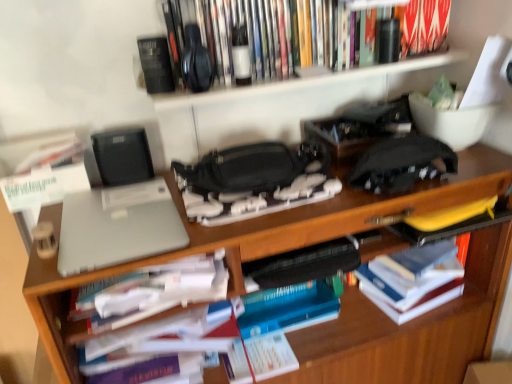
Question: Is sleek silver laptop at left located within wooden desk at center?

Choices:
 (A) yes
 (B) no

Answer: (A)

Question: Does wooden desk at center appear on the right side of sleek silver laptop at left?

Choices:
 (A) yes
 (B) no

Answer: (A)

Question: Is the depth of wooden desk at center greater than that of sleek silver laptop at left?

Choices:
 (A) no
 (B) yes

Answer: (A)

Question: Is wooden desk at center far away from sleek silver laptop at left?

Choices:
 (A) no
 (B) yes

Answer: (A)

Question: From the image's perspective, is wooden desk at center above sleek silver laptop at left?

Choices:
 (A) yes
 (B) no

Answer: (B)

Question: Considering the relative sizes of wooden desk at center and sleek silver laptop at left in the image provided, is wooden desk at center shorter than sleek silver laptop at left?

Choices:
 (A) yes
 (B) no

Answer: (B)

Question: Is hardcover book at right, the third book when ordered from top to bottom, placed right next to white paper at center?

Choices:
 (A) no
 (B) yes

Answer: (A)

Question: Can you confirm if hardcover book at right, the 1th book ordered from the bottom, is bigger than white paper at center?

Choices:
 (A) no
 (B) yes

Answer: (A)

Question: From the image's perspective, is hardcover book at right, the third book when ordered from top to bottom, located above white paper at center?

Choices:
 (A) no
 (B) yes

Answer: (B)

Question: Could you tell me if hardcover book at right, the 1th book ordered from the bottom, is turned towards white paper at center?

Choices:
 (A) yes
 (B) no

Answer: (B)

Question: Can you confirm if hardcover book at right, the 1th book ordered from the bottom, is shorter than white paper at center?

Choices:
 (A) yes
 (B) no

Answer: (A)

Question: Is hardcover book at right, the 1th book ordered from the bottom, far from white paper at center?

Choices:
 (A) yes
 (B) no

Answer: (B)

Question: Is hardcover books at upper center, the 1th book from the top, at the right side of white paper at center?

Choices:
 (A) yes
 (B) no

Answer: (A)